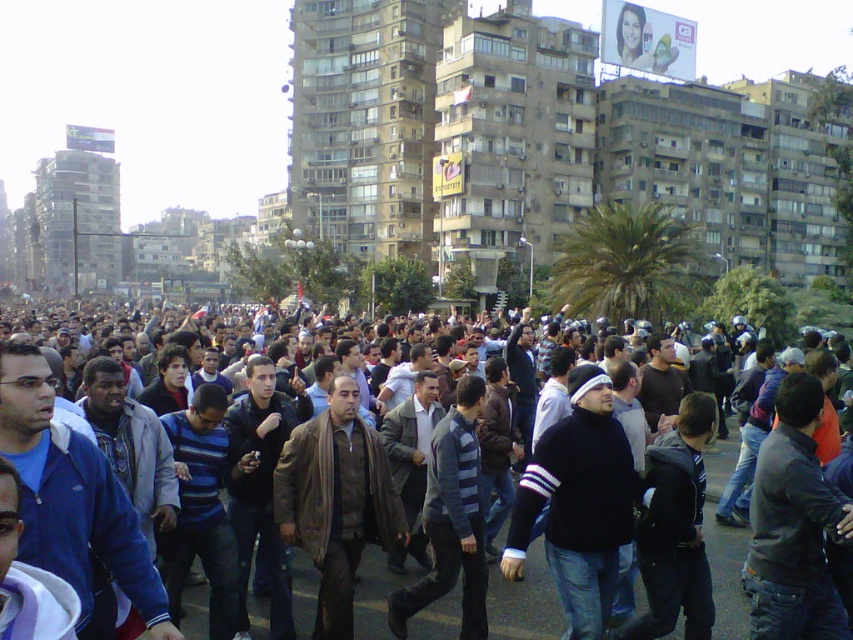
Question: Which object is the farthest from the brown leather jacket at center?

Choices:
 (A) dark brown leather jacket at center
 (B) black matte sweater at center

Answer: (B)

Question: Can you confirm if brown leather jacket at center is positioned below striped sweater at center?

Choices:
 (A) no
 (B) yes

Answer: (A)

Question: Does brown leather jacket at center appear on the right side of striped sweater at center?

Choices:
 (A) yes
 (B) no

Answer: (B)

Question: Estimate the real-world distances between objects in this image. Which object is closer to the brown leather jacket at center?

Choices:
 (A) dark brown leather jacket at center
 (B) striped sweater at center
 (C) black matte sweater at center

Answer: (B)

Question: Is dark brown leather jacket at center bigger than brown leather jacket at center?

Choices:
 (A) no
 (B) yes

Answer: (B)

Question: Based on their relative distances, which object is nearer to the black matte sweater at center?

Choices:
 (A) dark brown leather jacket at center
 (B) striped sweater at center
 (C) brown leather jacket at center

Answer: (B)